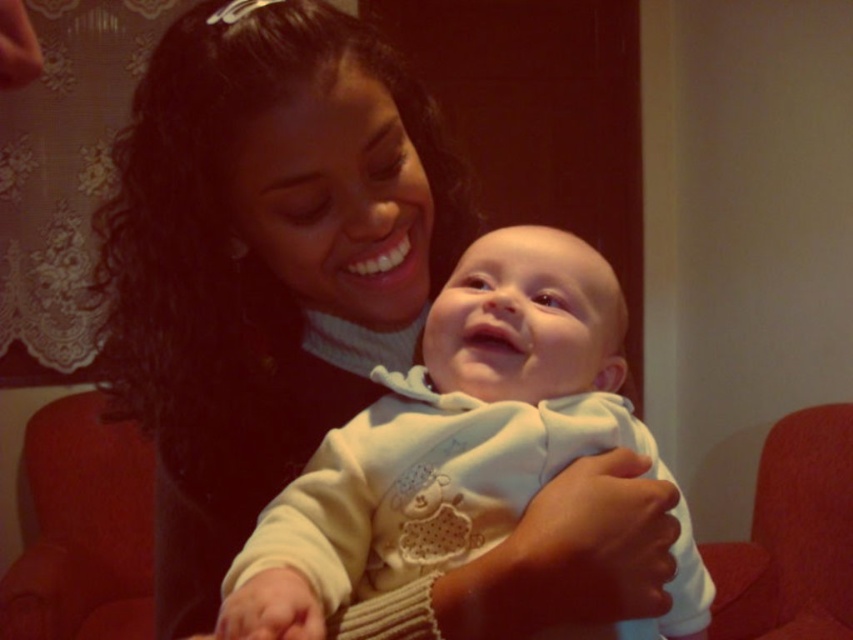
You are standing in the room where the adult and baby are interacting. You need to place a small sticker on the point closer to you between the two points labeled point (589, 300) and point (846, 531). Which point should you choose?

You should choose point (589, 300) because it is closer to the viewer than point (846, 531).

You are a photographer trying to capture a closeup of the white soft fabric baby at center. The camera you are using has a focal length of 50mm and an aperture of f2.8. You want to ensure that the baby is in focus while the background is slightly blurred. Based on the baby position at point 0.683, 0.526, what should be your focus point to achieve this effect?

To achieve a focused closeup of the white soft fabric baby at center with a blurred background, the focus point should be set at the baby position at point (448, 436). This ensures the baby is sharp while the background, like the red upholstered chair, is softly blurred.

You are a photographer standing at a distance of 16 inches from the white soft fabric baby at center. Can you take a clear photo of the baby without moving closer?

The white soft fabric baby at center is 15.75 inches away from the viewer. Since you are standing at 16 inches, which is slightly farther away, you would need to move closer by 0.25 inches to capture a clear photo.